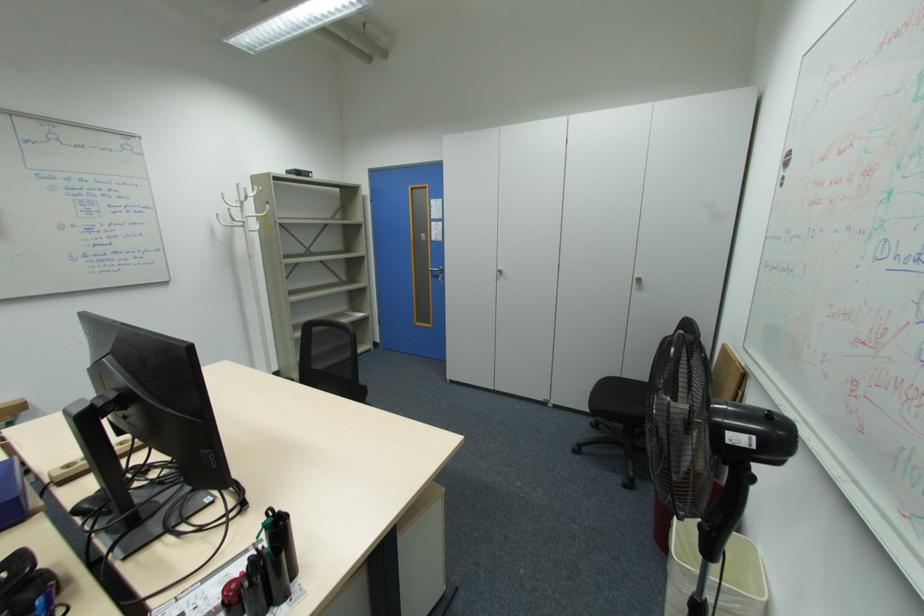
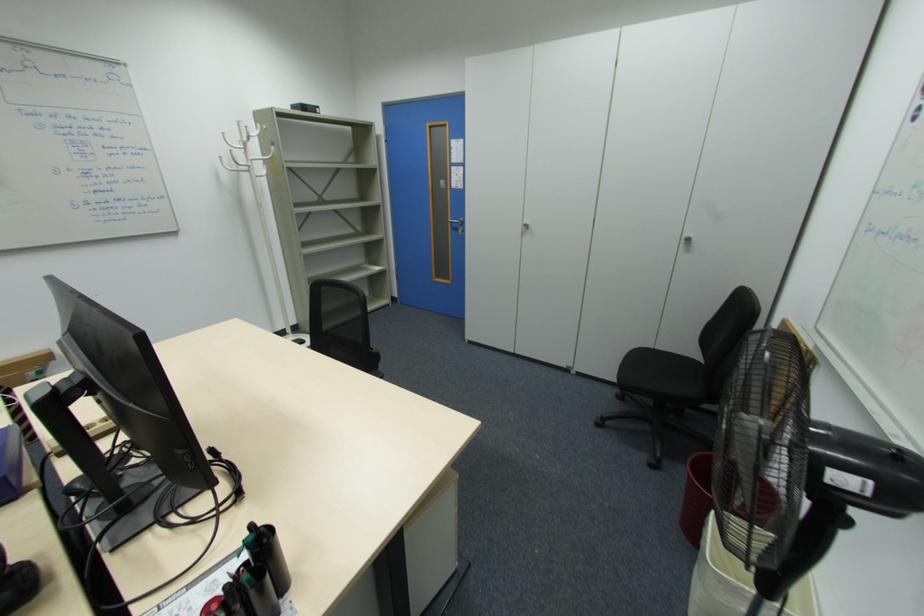
Question: The images are taken continuously from a first-person perspective. In which direction are you moving?

Choices:
 (A) Left
 (B) Right
 (C) Forward
 (D) Backward

Answer: (C)